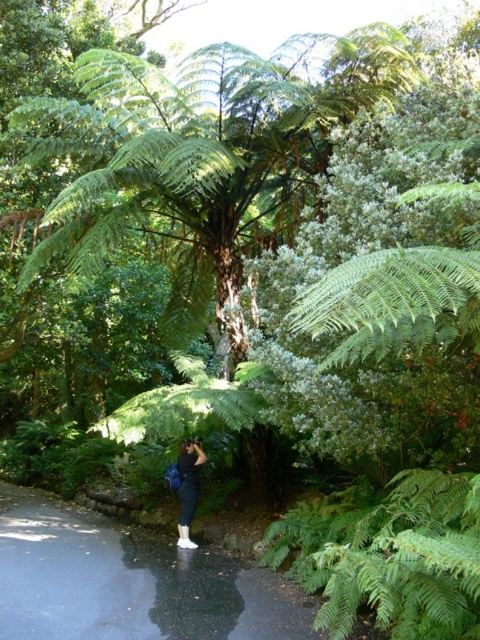
You are a photographer standing on the paved path in the forest. You want to take a photo that includes both the point at coordinates (63, 545) and the point at (422, 616). Which point should you focus on first to ensure both are in sharp focus?

You should focus on the point at coordinates (63, 545) first because it is closer to the camera than the point at (422, 616). By focusing on the closer point, the farther point will also be within the depth of field and appear sharp in the photo.